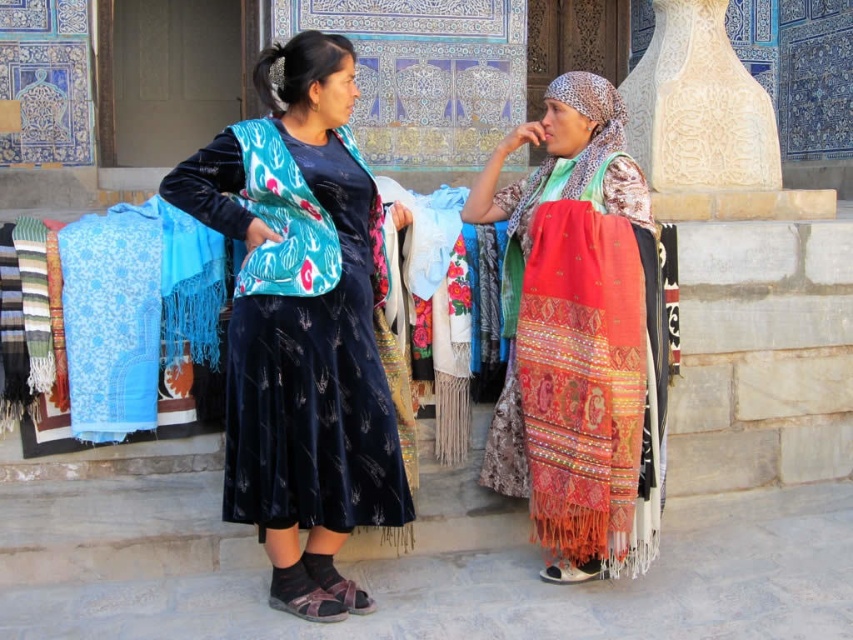
In the scene shown: Can you confirm if velvet blue dress at center is taller than red woven shawl at right?

No.

Between point (286, 100) and point (606, 92), which one is positioned in front?

Point (286, 100) is in front.

Is point (347, 257) farther from viewer compared to point (511, 308)?

No, it is in front of (511, 308).

Where is `velvet blue dress at center`? velvet blue dress at center is located at coordinates point(302,324).

Which is below, embroidered silk scarf at center or red woven shawl at right?

embroidered silk scarf at center is lower down.

Between embroidered silk scarf at center and red woven shawl at right, which one has more height?

red woven shawl at right is taller.

Is point (549, 374) positioned before point (585, 86)?

That is True.

You are a GUI agent. You are given a task and a screenshot of the screen. Output one action in this format:
    pyautogui.click(x=<x>, y=<y>)
    Task: Click on the embroidered silk scarf at center
    
    Given the screenshot: What is the action you would take?
    pyautogui.click(x=579, y=336)

Is velvet blue dress at center shorter than embroidered silk scarf at center?

No.

Does velvet blue dress at center have a greater width compared to embroidered silk scarf at center?

Correct, the width of velvet blue dress at center exceeds that of embroidered silk scarf at center.

Which is in front, point (280, 176) or point (577, 484)?

Point (577, 484)

Image resolution: width=853 pixels, height=640 pixels. I want to click on velvet blue dress at center, so click(x=302, y=324).